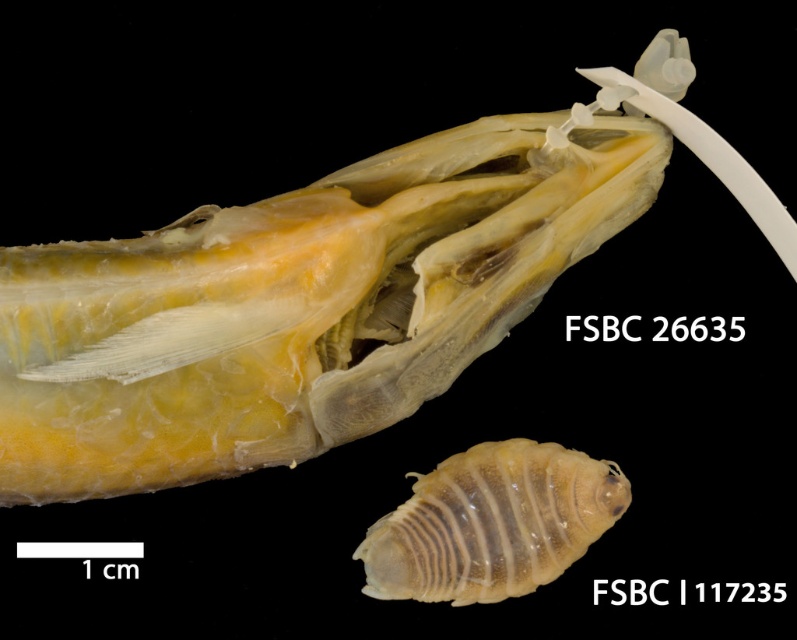
You are a researcher examining the scientific specimen preparation. You need to locate the translucent yellowish flesh at center for further analysis. According to the coordinates provided, where exactly is this object positioned?

The translucent yellowish flesh at center is located at point coordinates of 0.478 on the x and 0.374 on the y axis.